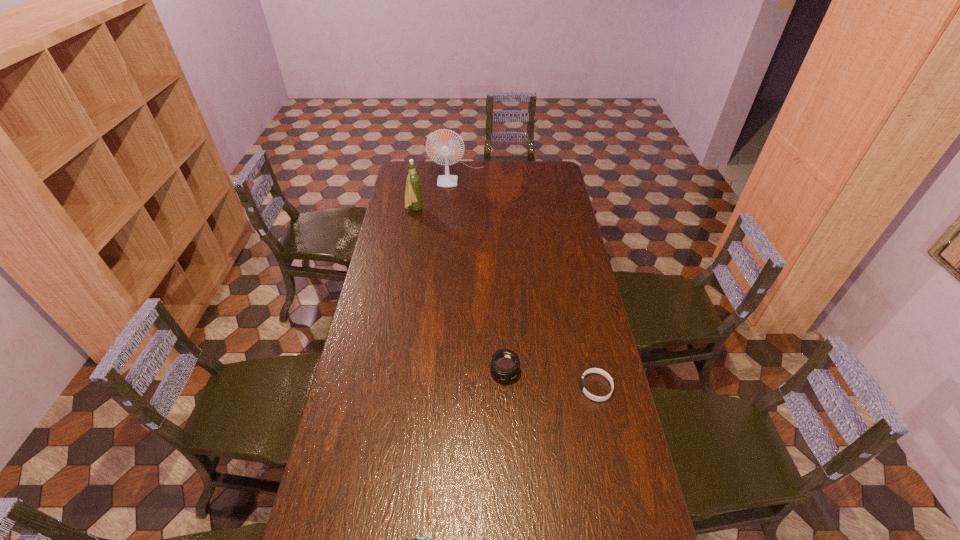
Locate an element on the screen. The width and height of the screenshot is (960, 540). fan is located at coordinates (445, 147).

Identify the location of the second tallest object. (413, 194).

Identify the location of the leftmost object. This screenshot has width=960, height=540. (413, 194).

Where is `the second object from right to left`? Image resolution: width=960 pixels, height=540 pixels. the second object from right to left is located at coordinates (504, 365).

This screenshot has height=540, width=960. Find the location of `the third tallest object`. the third tallest object is located at coordinates (504, 365).

Where is `the right wristband`? the right wristband is located at coordinates (593, 370).

The image size is (960, 540). What are the coordinates of `the taller wristband` in the screenshot? It's located at tap(593, 370).

Where is `vacant area located on the front-facing side of the farthest object`? vacant area located on the front-facing side of the farthest object is located at coordinates (456, 199).

Identify the location of vacant space located 0.360m on the front-facing side of the fourth shortest object. The image size is (960, 540). pos(493,210).

You are a GUI agent. You are given a task and a screenshot of the screen. Output one action in this format:
    pyautogui.click(x=<x>, y=<y>)
    Task: Click on the vacant space located on the side of the second object from right to left with brand markings and control switches
    
    Given the screenshot: What is the action you would take?
    pyautogui.click(x=507, y=433)